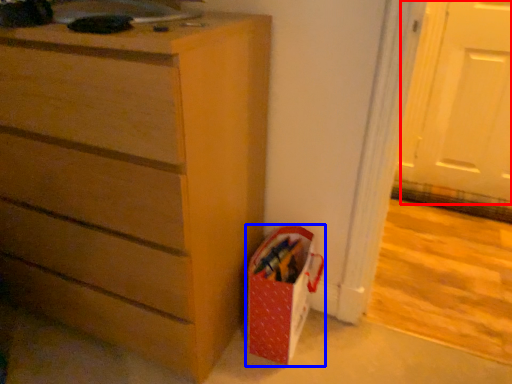
Question: Among these objects, which one is nearest to the camera, screen door (highlighted by a red box) or gift bag (highlighted by a blue box)?

Choices:
 (A) screen door
 (B) gift bag

Answer: (B)